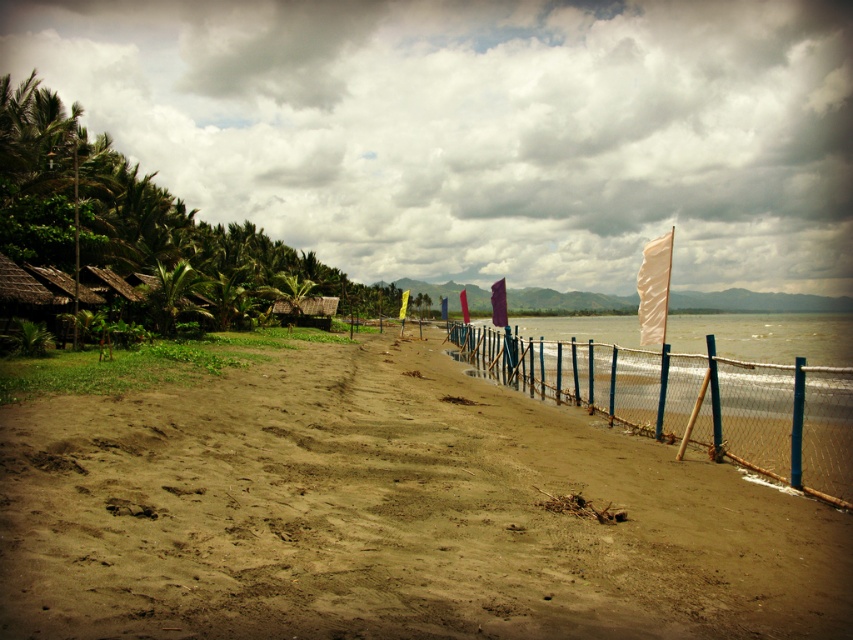
Question: Which of the following is the farthest from the observer?

Choices:
 (A) (38, 445)
 (B) (523, 324)
 (C) (786, 476)

Answer: (B)

Question: Does brown sandy dirt field at center appear over blue wire mesh fence at center?

Choices:
 (A) no
 (B) yes

Answer: (A)

Question: Which point is closer to the camera?

Choices:
 (A) (764, 456)
 (B) (601, 317)

Answer: (A)

Question: Which of these objects is positioned farthest from the brown sandy dirt field at center?

Choices:
 (A) blue wire mesh fence at center
 (B) translucent plastic water at center

Answer: (B)

Question: Observing the image, what is the correct spatial positioning of brown sandy dirt field at center in reference to translucent plastic water at center?

Choices:
 (A) above
 (B) below

Answer: (B)

Question: Can you confirm if blue wire mesh fence at center is positioned to the right of translucent plastic water at center?

Choices:
 (A) no
 (B) yes

Answer: (A)